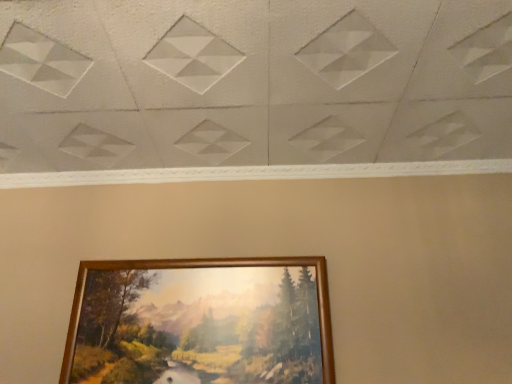
The width and height of the screenshot is (512, 384). Describe the element at coordinates (200, 322) in the screenshot. I see `wooden picture frame at center` at that location.

Identify the location of wooden picture frame at center. (200, 322).

The image size is (512, 384). What are the coordinates of `wooden picture frame at center` in the screenshot? It's located at (200, 322).